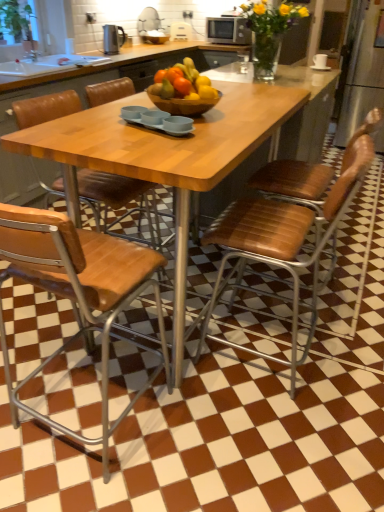
This screenshot has height=512, width=384. Identify the location of free space underneath wooden bowl at center (from a real-world perspective). (195, 302).